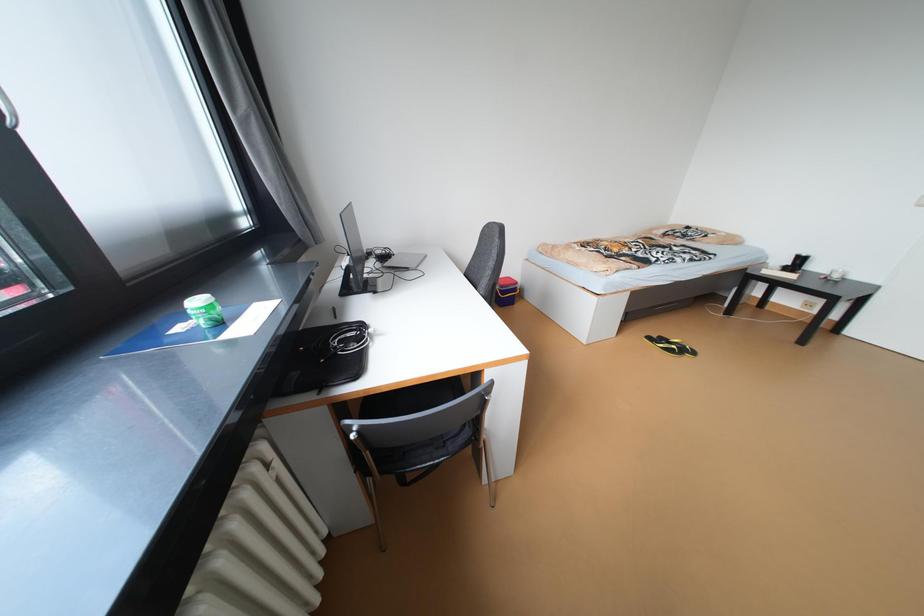
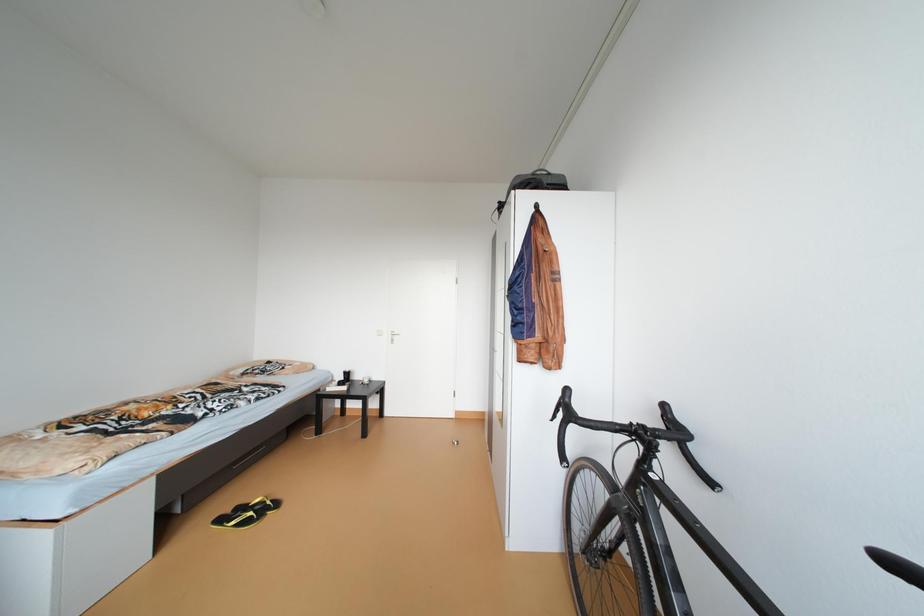
Question: Based on the continuous images, in which direction is the camera rotating? Reply with the corresponding letter.

Choices:
 (A) Left
 (B) Right
 (C) Up
 (D) Down

Answer: (B)